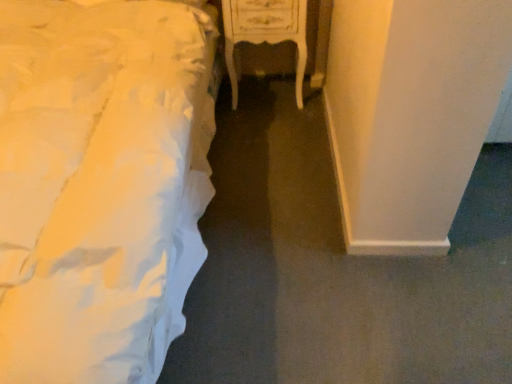
Question: Considering the positions of point [76, 36] and point [304, 69], is point [76, 36] closer or farther from the camera than point [304, 69]?

Choices:
 (A) closer
 (B) farther

Answer: (A)

Question: In terms of width, does white fabric bed at left look wider or thinner when compared to white glossy nightstand at center?

Choices:
 (A) wide
 (B) thin

Answer: (A)

Question: Based on their positions, is white fabric bed at left located to the left or right of white glossy nightstand at center?

Choices:
 (A) left
 (B) right

Answer: (A)

Question: Would you say white glossy nightstand at center is to the left or to the right of white fabric bed at left in the picture?

Choices:
 (A) left
 (B) right

Answer: (B)

Question: In terms of width, does white glossy nightstand at center look wider or thinner when compared to white fabric bed at left?

Choices:
 (A) wide
 (B) thin

Answer: (B)

Question: From a real-world perspective, is white glossy nightstand at center positioned above or below white fabric bed at left?

Choices:
 (A) below
 (B) above

Answer: (A)

Question: Considering their positions, is white glossy nightstand at center located in front of or behind white fabric bed at left?

Choices:
 (A) behind
 (B) front

Answer: (A)